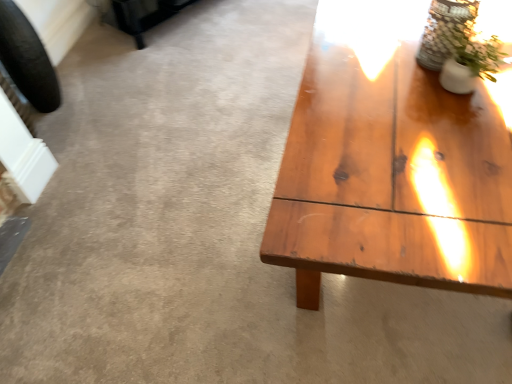
Question: Looking at their shapes, would you say clear glass vase at upper right is wider or thinner than black rubber tire at left?

Choices:
 (A) wide
 (B) thin

Answer: (A)

Question: From a real-world perspective, relative to black rubber tire at left, is clear glass vase at upper right vertically above or below?

Choices:
 (A) below
 (B) above

Answer: (B)

Question: Which object is the closest to the clear glass vase at upper right?

Choices:
 (A) white ceramic vase at upper right
 (B) black rubber tire at left

Answer: (A)

Question: Which object is positioned closest to the black rubber tire at left?

Choices:
 (A) white ceramic vase at upper right
 (B) clear glass vase at upper right

Answer: (B)